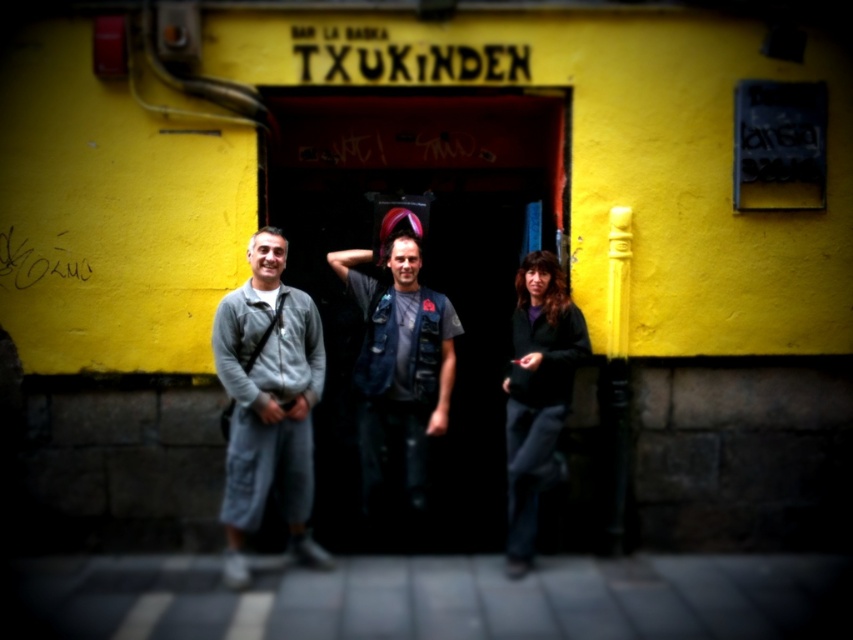
Question: Can you confirm if gray fabric pants at left is wider than denim vest at center?

Choices:
 (A) no
 (B) yes

Answer: (A)

Question: Which object is closer to the camera taking this photo?

Choices:
 (A) dark gray sweater at lower right
 (B) gray fabric pants at left
 (C) denim vest at center

Answer: (B)

Question: Estimate the real-world distances between objects in this image. Which object is closer to the gray fabric pants at left?

Choices:
 (A) denim vest at center
 (B) dark gray sweater at lower right

Answer: (A)

Question: Among these points, which one is farthest from the camera?

Choices:
 (A) (309, 497)
 (B) (352, 289)
 (C) (543, 316)

Answer: (B)

Question: Is denim vest at center wider than dark gray sweater at lower right?

Choices:
 (A) no
 (B) yes

Answer: (B)

Question: Where is gray fabric pants at left located in relation to dark gray sweater at lower right in the image?

Choices:
 (A) left
 (B) right

Answer: (A)